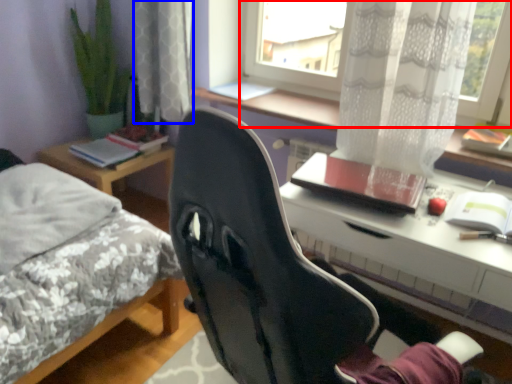
Question: Which of the following is the closest to the observer, window (highlighted by a red box) or curtain (highlighted by a blue box)?

Choices:
 (A) window
 (B) curtain

Answer: (A)